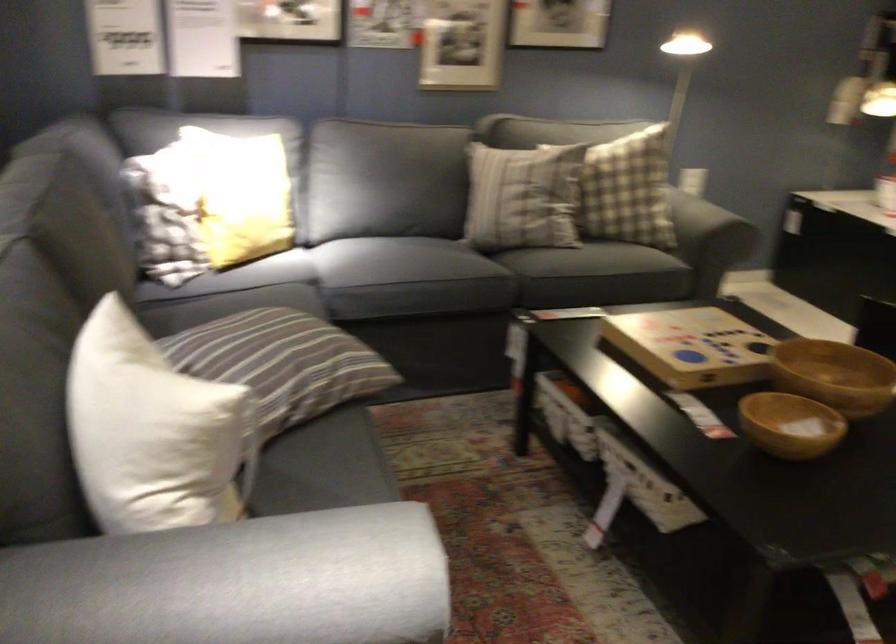
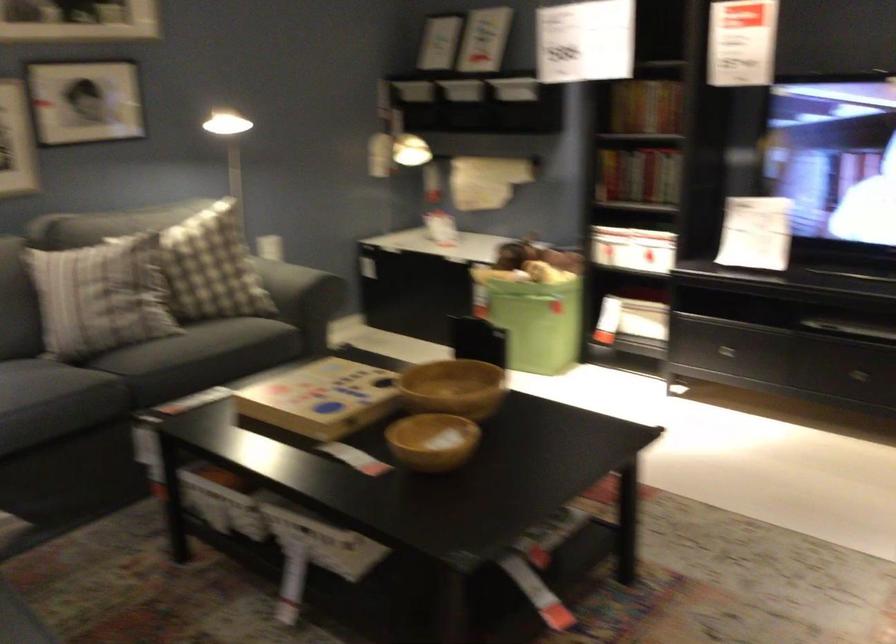
The point at [684,345] is marked in the first image. Where is the corresponding point in the second image?

(320, 399)